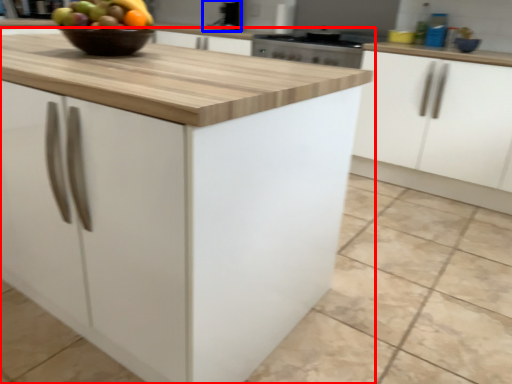
Question: Which of the following is the farthest to the observer, cabinetry (highlighted by a red box) or sink (highlighted by a blue box)?

Choices:
 (A) cabinetry
 (B) sink

Answer: (B)